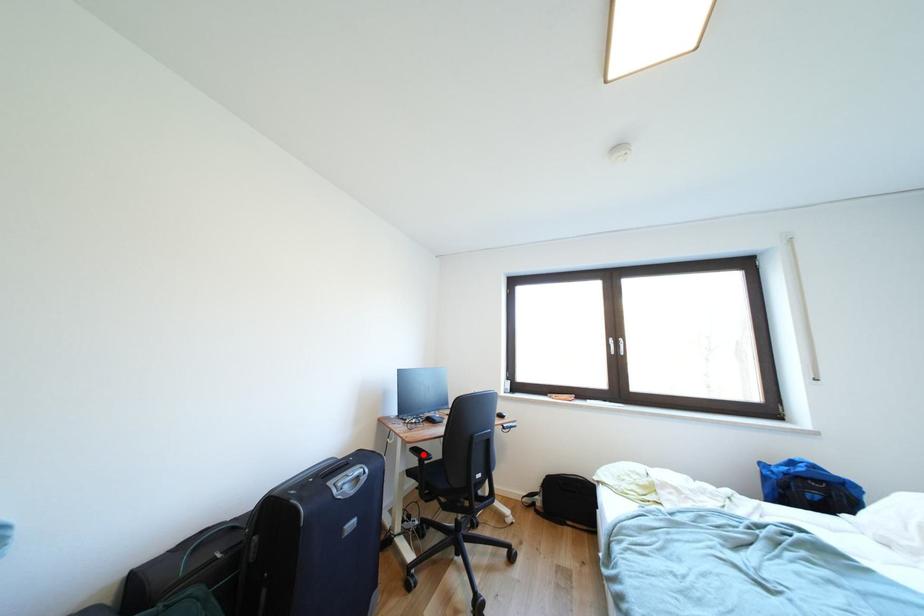
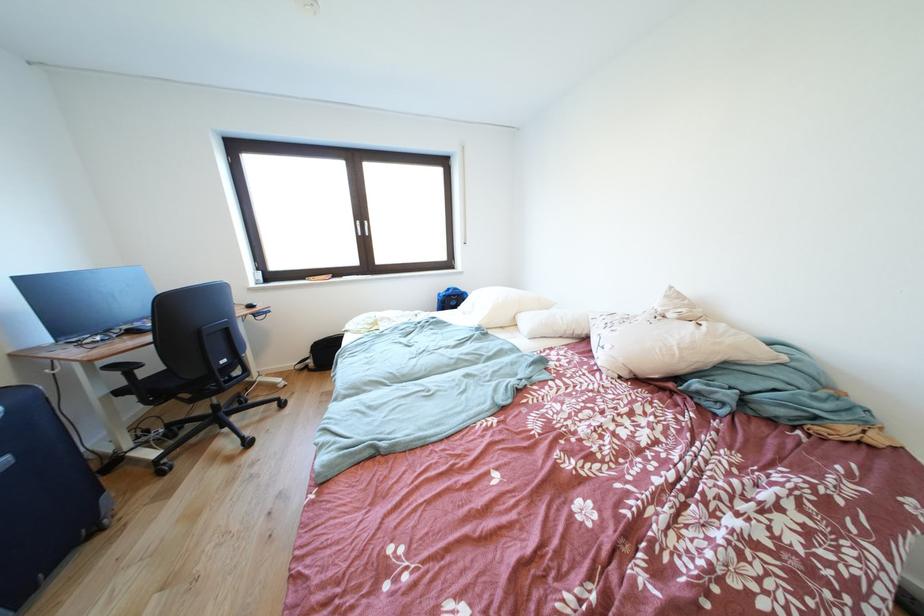
Find the pixel in the second image that matches the highlighted location in the first image.

(120, 371)